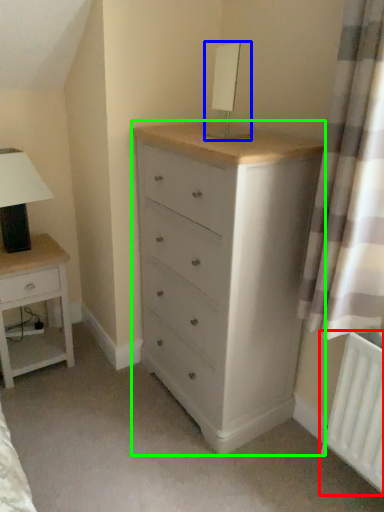
Question: Which is farther away from radiator (highlighted by a red box)? table lamp (highlighted by a blue box) or chest of drawers (highlighted by a green box)?

Choices:
 (A) table lamp
 (B) chest of drawers

Answer: (A)